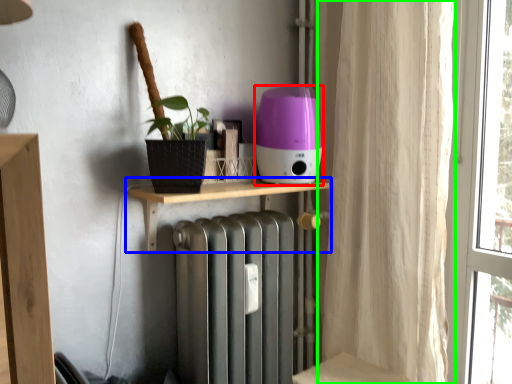
Question: Which is nearer to the appliance (highlighted by a red box)? shelf (highlighted by a blue box) or curtain (highlighted by a green box).

Choices:
 (A) shelf
 (B) curtain

Answer: (A)